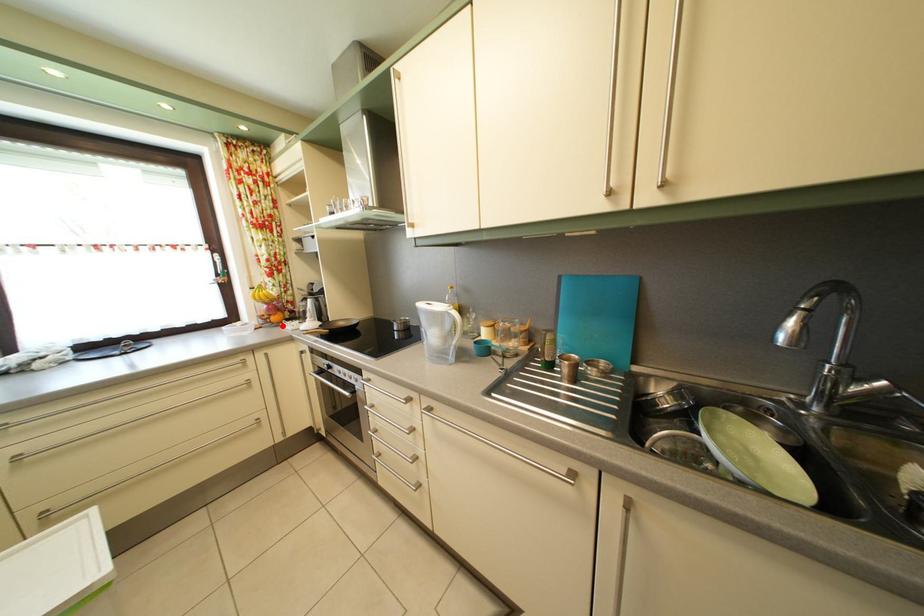
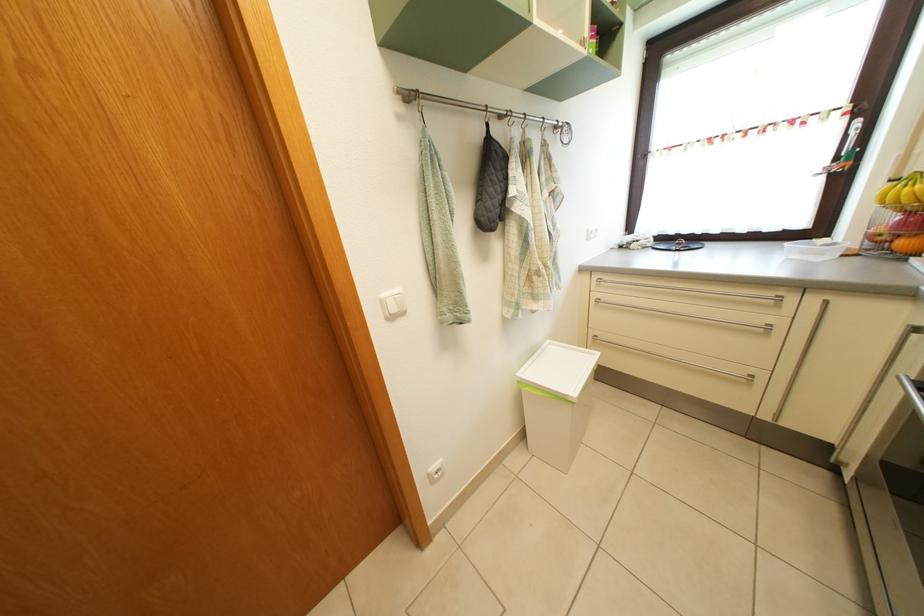
Find the pixel in the second image that matches the highlighted location in the first image.

(910, 252)